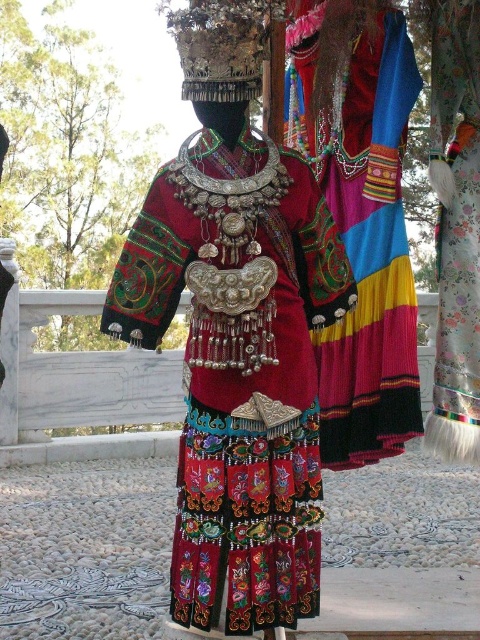
Question: Is the position of velvet embroidered dress at center less distant than that of embroidered silk skirt at center?

Choices:
 (A) yes
 (B) no

Answer: (A)

Question: Is velvet embroidered dress at center bigger than velvet floral skirt at center?

Choices:
 (A) no
 (B) yes

Answer: (B)

Question: Which is farther from the velvet floral skirt at center?

Choices:
 (A) velvet embroidered dress at center
 (B) embroidered silk skirt at center

Answer: (A)

Question: Can you confirm if velvet embroidered dress at center is wider than embroidered silk skirt at center?

Choices:
 (A) no
 (B) yes

Answer: (B)

Question: Among these points, which one is nearest to the camera?

Choices:
 (A) 286,305
 (B) 453,384
 (C) 371,65

Answer: (A)

Question: Estimate the real-world distances between objects in this image. Which object is farther from the velvet floral skirt at center?

Choices:
 (A) embroidered silk skirt at center
 (B) velvet embroidered dress at center

Answer: (B)